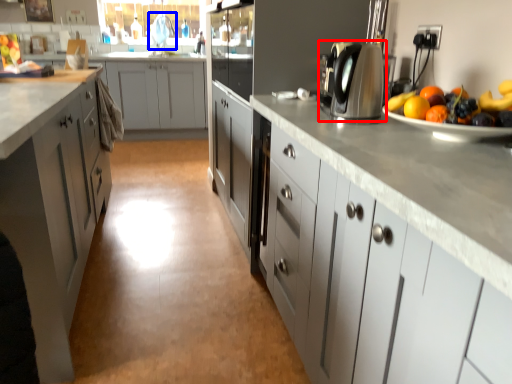
Question: Which of the following is the closest to the observer, home appliance (highlighted by a red box) or faucet (highlighted by a blue box)?

Choices:
 (A) home appliance
 (B) faucet

Answer: (A)